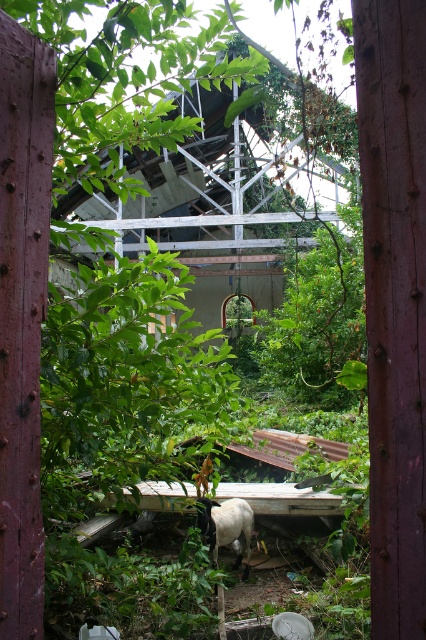
You are a wildlife photographer aiming to capture the white woolly sheep at center without the concrete structure at center obstructing the view. Based on the scene description, is there a position you can move to where the sheep is visible but the structure is not?

The white woolly sheep at center is behind the concrete structure at center. Therefore, if you move to a position in front of the concrete structure at center, you can see the sheep without the structure blocking the view.

You are a wildlife photographer aiming to capture both the concrete structure at center and the white woolly sheep at center in a single frame. Based on their sizes, which one should you focus on first to ensure both fit in the shot?

The concrete structure at center is smaller than the white woolly sheep at center, so you should focus on the white woolly sheep at center first to ensure both fit in the shot.

You are standing at a viewpoint 15 meters away from the partially collapsed structure. You notice a specific point marked at coordinates point [264,260]. Can you determine if this point is closer to you than the structure?

The distance of point [264,260] from viewer is 15.79 meters, which is slightly farther than your current position at 15 meters. Therefore, the point is farther away from you than the structure.